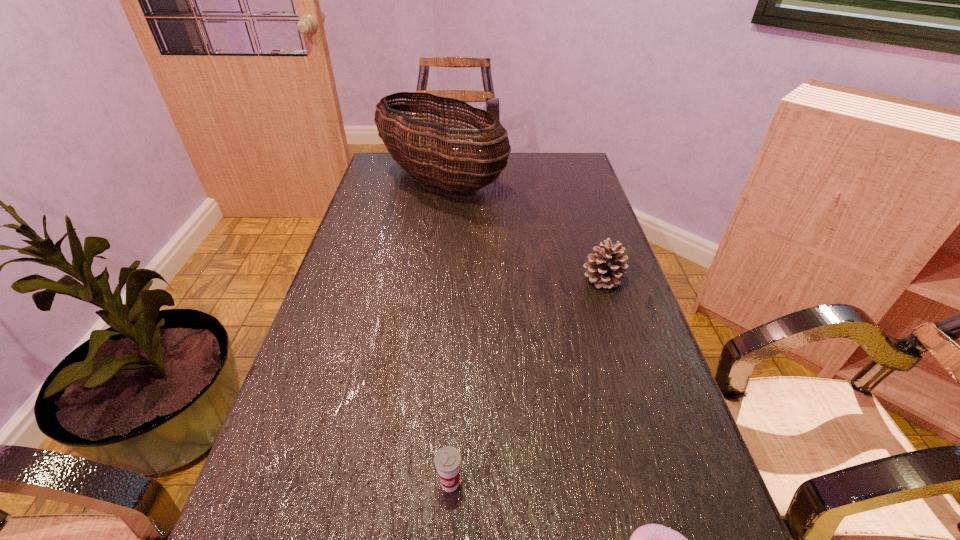
The image size is (960, 540). I want to click on free space between the cup and the tallest object, so click(x=445, y=332).

Identify the location of blank region between the second farthest object and the cup. (526, 381).

Locate an element on the screen. Image resolution: width=960 pixels, height=540 pixels. object that is the closest to the pinecone is located at coordinates (405, 144).

Identify which object is located as the third nearest to the third nearest object. Please provide its 2D coordinates. Your answer should be formatted as a tuple, i.e. [(x, y)], where the tuple contains the x and y coordinates of a point satisfying the conditions above.

[(652, 539)]

This screenshot has width=960, height=540. Identify the location of vacant region that satisfies the following two spatial constraints: 1. on the front side of the pinecone; 2. on the right side of the tallest object. (428, 279).